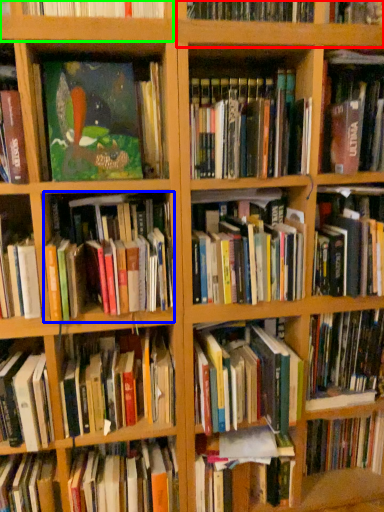
Question: Estimate the real-world distances between objects in this image. Which object is farther from shelf (highlighted by a red box), book (highlighted by a blue box) or shelf (highlighted by a green box)?

Choices:
 (A) book
 (B) shelf

Answer: (A)